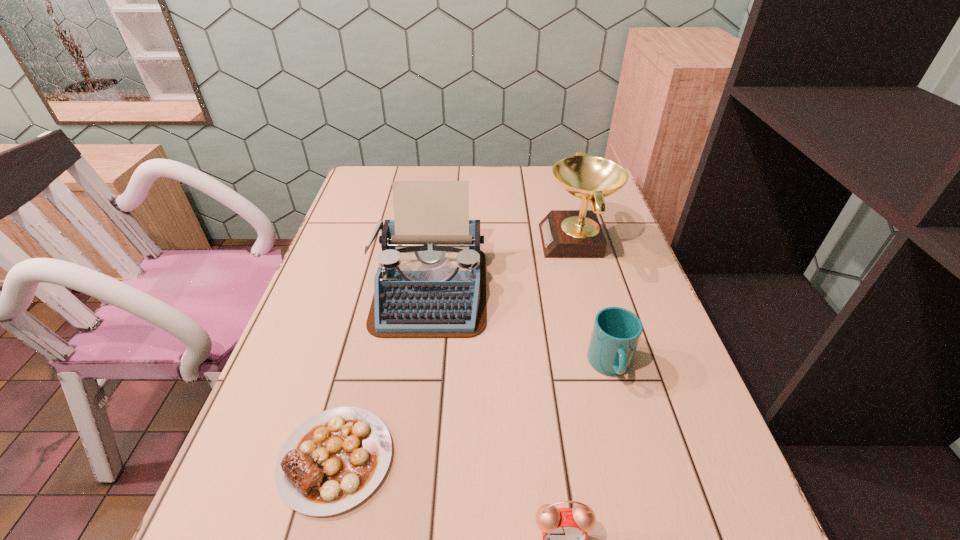
At what (x,y) coordinates should I click in order to perform the action: click on free space located 0.250m on the back of the steak. Please return your answer as a coordinate pair (x, y). The width and height of the screenshot is (960, 540). Looking at the image, I should click on (372, 315).

This screenshot has height=540, width=960. I want to click on typewriter present at the left edge, so click(x=431, y=281).

Where is `steak positioned at the left edge`? This screenshot has width=960, height=540. steak positioned at the left edge is located at coordinates (334, 460).

At what (x,y) coordinates should I click in order to perform the action: click on award situated at the right edge. Please return your answer as a coordinate pair (x, y). Looking at the image, I should click on (564, 233).

Find the location of a particular element. cup that is positioned at the right edge is located at coordinates (616, 332).

In the image, there is a desktop. At what (x,y) coordinates should I click in order to perform the action: click on vacant space at the far edge. Please return your answer as a coordinate pair (x, y). Looking at the image, I should click on (532, 184).

Identify the location of vacant space at the left edge of the desktop. The width and height of the screenshot is (960, 540). (325, 282).

I want to click on vacant area that lies between the second nearest object and the typewriter, so 383,374.

You are a GUI agent. You are given a task and a screenshot of the screen. Output one action in this format:
    pyautogui.click(x=<x>, y=<y>)
    Task: Click on the free space between the fourth farthest object and the typewriter
    The width and height of the screenshot is (960, 540).
    Given the screenshot: What is the action you would take?
    pyautogui.click(x=383, y=374)

This screenshot has height=540, width=960. In order to click on vacant space that's between the typewriter and the award in this screenshot , I will do `click(503, 265)`.